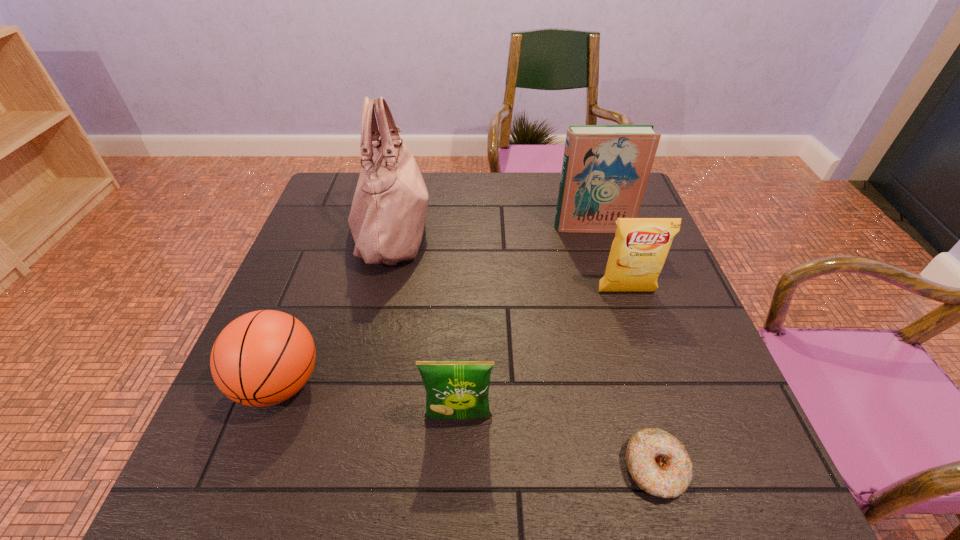
This screenshot has height=540, width=960. In order to click on free point between the hardback book and the basketball in this screenshot , I will do `click(436, 306)`.

You are a GUI agent. You are given a task and a screenshot of the screen. Output one action in this format:
    pyautogui.click(x=<x>, y=<y>)
    Task: Click on the empty space between the basketball and the left crisp (potato chip)
    The image size is (960, 540).
    Given the screenshot: What is the action you would take?
    pyautogui.click(x=370, y=400)

Identify the location of vacant area between the hardback book and the shorter crisp (potato chip). The height and width of the screenshot is (540, 960). (526, 322).

Where is `vacant region between the handbag and the shortest object`? This screenshot has height=540, width=960. vacant region between the handbag and the shortest object is located at coordinates (524, 349).

You are a GUI agent. You are given a task and a screenshot of the screen. Output one action in this format:
    pyautogui.click(x=<x>, y=<y>)
    Task: Click on the vacant space in between the tallest object and the fourth shortest object
    This screenshot has height=540, width=960.
    Given the screenshot: What is the action you would take?
    pyautogui.click(x=510, y=261)

Identify the location of vacant area between the doughnut and the hardback book. The width and height of the screenshot is (960, 540). (624, 348).

Identify the location of vacant area that lies between the nearer crisp (potato chip) and the basketball. The image size is (960, 540). (370, 400).

Locate an element on the screen. This screenshot has height=540, width=960. unoccupied area between the farther crisp (potato chip) and the tallest object is located at coordinates (510, 261).

Identify which object is the fourth closest to the basketball. Please provide its 2D coordinates. Your answer should be formatted as a tuple, i.e. [(x, y)], where the tuple contains the x and y coordinates of a point satisfying the conditions above.

[(640, 247)]

Locate an element on the screen. The image size is (960, 540). object that stands as the fifth closest to the fifth shortest object is located at coordinates (262, 358).